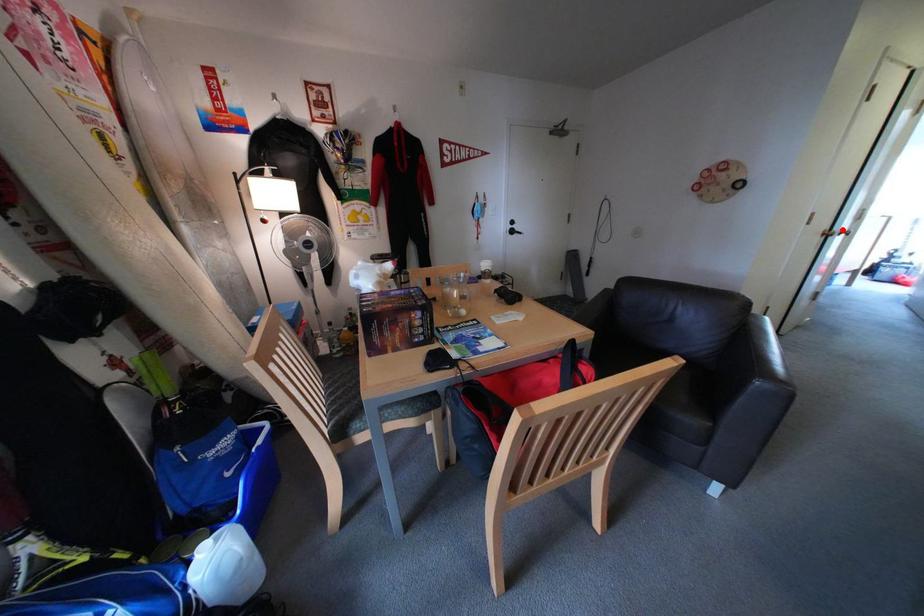
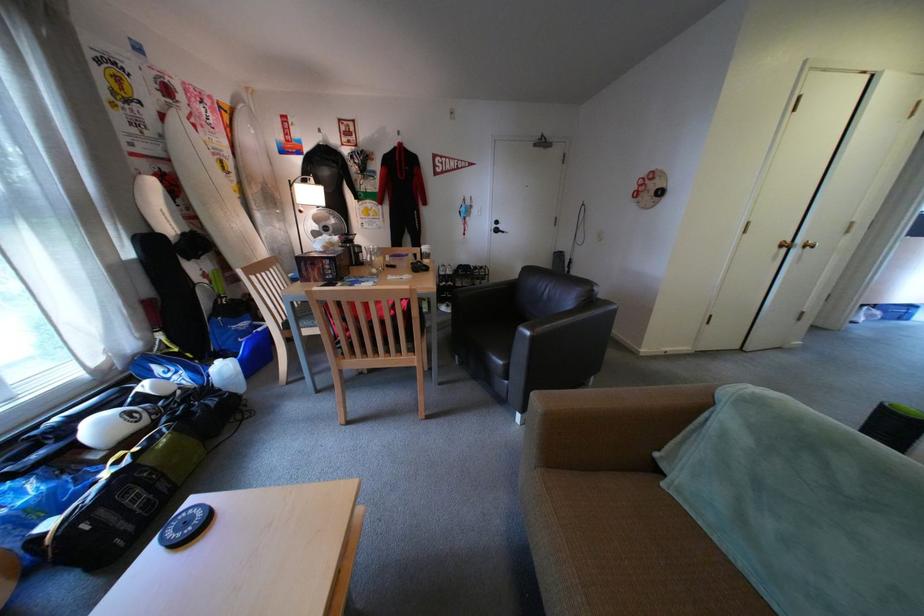
In the second image, find the point that corresponds to the highlighted location in the first image.

(804, 241)